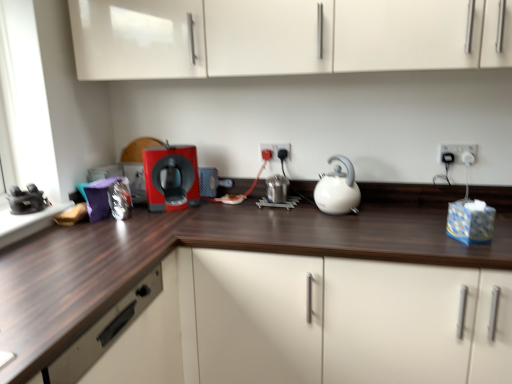
Question: Should I look upward or downward to see white glossy kettle at center?

Choices:
 (A) up
 (B) down

Answer: (A)

Question: Is wooden drawer at lower left at the left side of matte plastic coffee machine at center?

Choices:
 (A) yes
 (B) no

Answer: (A)

Question: Does wooden drawer at lower left have a smaller size compared to matte plastic coffee machine at center?

Choices:
 (A) no
 (B) yes

Answer: (A)

Question: Does wooden drawer at lower left lie in front of matte plastic coffee machine at center?

Choices:
 (A) yes
 (B) no

Answer: (A)

Question: Considering the relative sizes of wooden drawer at lower left and matte plastic coffee machine at center in the image provided, is wooden drawer at lower left shorter than matte plastic coffee machine at center?

Choices:
 (A) yes
 (B) no

Answer: (B)

Question: Does wooden drawer at lower left touch matte plastic coffee machine at center?

Choices:
 (A) yes
 (B) no

Answer: (B)

Question: From the image's perspective, is wooden drawer at lower left on top of matte plastic coffee machine at center?

Choices:
 (A) yes
 (B) no

Answer: (B)

Question: From a real-world perspective, is matte plastic coffee machine at center on white plastic electric outlet at upper right, positioned as the 2th electric outlet in back-to-front order?

Choices:
 (A) yes
 (B) no

Answer: (B)

Question: Is matte plastic coffee machine at center at the right side of white plastic electric outlet at upper right, positioned as the 2th electric outlet in back-to-front order?

Choices:
 (A) yes
 (B) no

Answer: (B)

Question: Is matte plastic coffee machine at center in contact with white plastic electric outlet at upper right, positioned as the 2th electric outlet in back-to-front order?

Choices:
 (A) yes
 (B) no

Answer: (B)

Question: Is matte plastic coffee machine at center taller than white plastic electric outlet at upper right, placed as the first electric outlet when sorted from front to back?

Choices:
 (A) yes
 (B) no

Answer: (A)

Question: Is the depth of matte plastic coffee machine at center less than that of white plastic electric outlet at upper right, the first electric outlet from the right?

Choices:
 (A) yes
 (B) no

Answer: (B)

Question: Can you confirm if matte plastic coffee machine at center is bigger than white plastic electric outlet at upper right, which is the second electric outlet in left-to-right order?

Choices:
 (A) yes
 (B) no

Answer: (A)

Question: Is matte plastic plug at center, the 1th electric outlet in the back-to-front sequence, wider than matte plastic coffee machine at center?

Choices:
 (A) yes
 (B) no

Answer: (B)